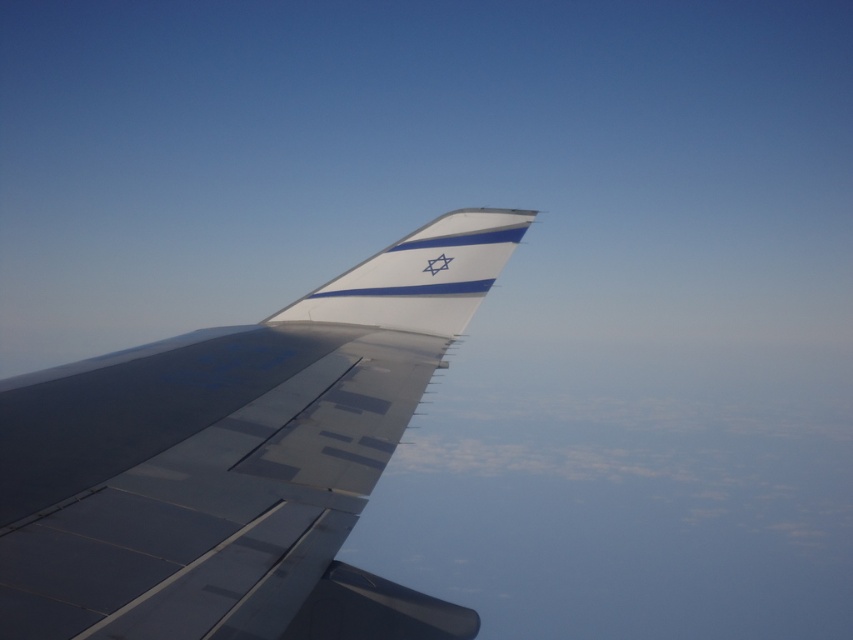
You are a passenger sitting in the airplane and looking out the window. You notice two points marked on the wingtip. The first point is at coordinates point [457,336] and the second is at point [402,280]. If you were to draw a straight line from your eye level towards each point, which point would the line reach first?

Point [457,336] is in front of point [402,280], so the line to point [457,336] would reach it first.

You are a flight attendant on an airplane and need to retrieve a tool from the storage compartment near the wing. The tool is placed between the metallic gray wing at center and the white glossy tail at center. Can you reach it without moving more than 1.5 meters from your current position?

The metallic gray wing at center and white glossy tail at center are 1.52 meters apart. Since the distance between them is slightly more than 1.5 meters, you cannot reach the tool without moving more than 1.5 meters from your current position.

You are a flight attendant on an airplane. You look out the window and see the metallic gray wing at center and the white glossy tail at center. Which object is closer to the left side of the window?

The metallic gray wing at center is closer to the left side of the window because it is positioned to the left of the white glossy tail at center.